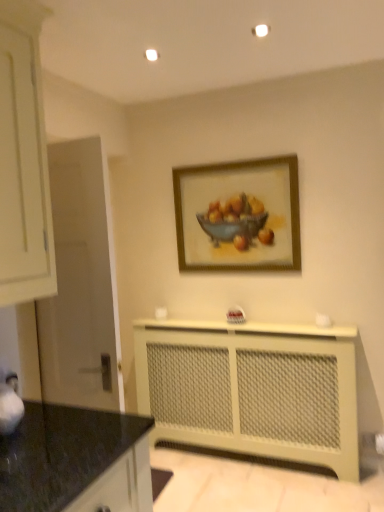
Question: Is wooden frame at upper center bigger than black granite countertop at lower left?

Choices:
 (A) no
 (B) yes

Answer: (A)

Question: Is wooden frame at upper center closer to camera compared to black granite countertop at lower left?

Choices:
 (A) no
 (B) yes

Answer: (A)

Question: From a real-world perspective, is wooden frame at upper center positioned over black granite countertop at lower left based on gravity?

Choices:
 (A) yes
 (B) no

Answer: (A)

Question: Can you confirm if wooden frame at upper center is taller than black granite countertop at lower left?

Choices:
 (A) yes
 (B) no

Answer: (A)

Question: Considering the relative sizes of wooden frame at upper center and black granite countertop at lower left in the image provided, is wooden frame at upper center wider than black granite countertop at lower left?

Choices:
 (A) yes
 (B) no

Answer: (B)

Question: Would you say wooden frame at upper center is inside or outside beige mesh radiator at lower center?

Choices:
 (A) inside
 (B) outside

Answer: (B)

Question: In the image, is wooden frame at upper center on the left side or the right side of beige mesh radiator at lower center?

Choices:
 (A) right
 (B) left

Answer: (B)

Question: Based on their sizes in the image, would you say wooden frame at upper center is bigger or smaller than beige mesh radiator at lower center?

Choices:
 (A) small
 (B) big

Answer: (A)

Question: Considering their positions, is wooden frame at upper center located in front of or behind beige mesh radiator at lower center?

Choices:
 (A) front
 (B) behind

Answer: (B)

Question: Would you say black granite countertop at lower left is inside or outside beige mesh radiator at lower center?

Choices:
 (A) outside
 (B) inside

Answer: (A)

Question: From a real-world perspective, relative to beige mesh radiator at lower center, is black granite countertop at lower left vertically above or below?

Choices:
 (A) below
 (B) above

Answer: (B)

Question: Based on their positions, is black granite countertop at lower left located to the left or right of beige mesh radiator at lower center?

Choices:
 (A) right
 (B) left

Answer: (B)

Question: Considering the positions of black granite countertop at lower left and beige mesh radiator at lower center in the image, is black granite countertop at lower left wider or thinner than beige mesh radiator at lower center?

Choices:
 (A) thin
 (B) wide

Answer: (B)

Question: Based on their sizes in the image, would you say wooden frame at upper center is bigger or smaller than black granite countertop at lower left?

Choices:
 (A) small
 (B) big

Answer: (A)

Question: Is wooden frame at upper center taller or shorter than black granite countertop at lower left?

Choices:
 (A) tall
 (B) short

Answer: (A)